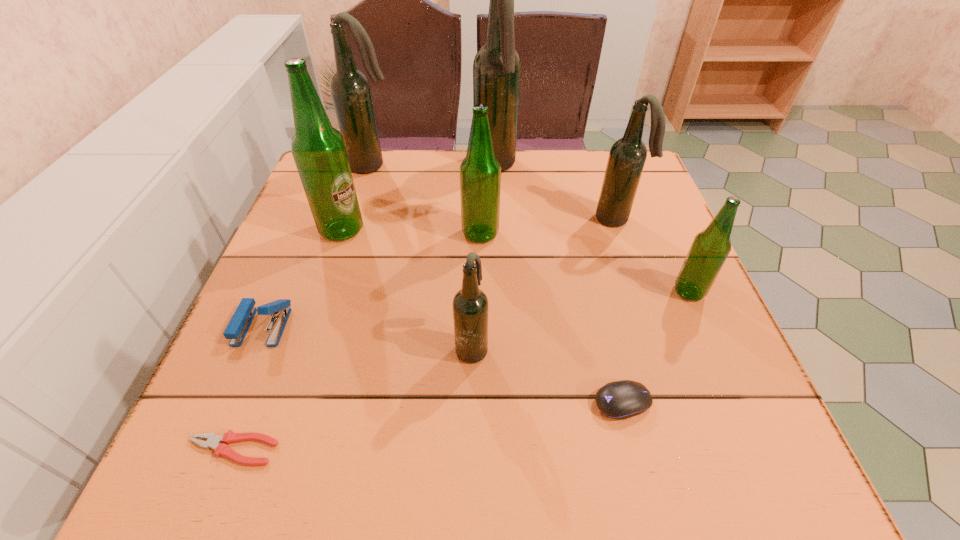
Locate an element on the screen. Image resolution: width=960 pixels, height=540 pixels. free space located 0.360m on the right of the shortest object is located at coordinates (518, 449).

Locate an element on the screen. object situated at the near edge is located at coordinates (213, 441).

At what (x,y) coordinates should I click in order to perform the action: click on stapler that is at the left edge. Please return your answer as a coordinate pair (x, y). Looking at the image, I should click on (236, 330).

Identify the location of pliers that is at the left edge. (213, 441).

You are a GUI agent. You are given a task and a screenshot of the screen. Output one action in this format:
    pyautogui.click(x=<x>, y=<y>)
    Task: Click on the object that is at the far left corner
    The image size is (960, 540).
    Given the screenshot: What is the action you would take?
    pyautogui.click(x=350, y=90)

What are the coordinates of `object at the near left corner` in the screenshot? It's located at (213, 441).

This screenshot has height=540, width=960. Find the location of `free spot at the far edge of the desktop`. free spot at the far edge of the desktop is located at coordinates point(555,194).

You are a GUI agent. You are given a task and a screenshot of the screen. Output one action in this format:
    pyautogui.click(x=<x>, y=<y>)
    Task: Click on the free space at the near edge of the desktop
    The height and width of the screenshot is (540, 960).
    Given the screenshot: What is the action you would take?
    pyautogui.click(x=547, y=443)

Locate an element on the screen. This screenshot has width=960, height=540. free space at the left edge of the desktop is located at coordinates (326, 249).

Where is `vacant region at the right edge of the desktop`? vacant region at the right edge of the desktop is located at coordinates [656, 291].